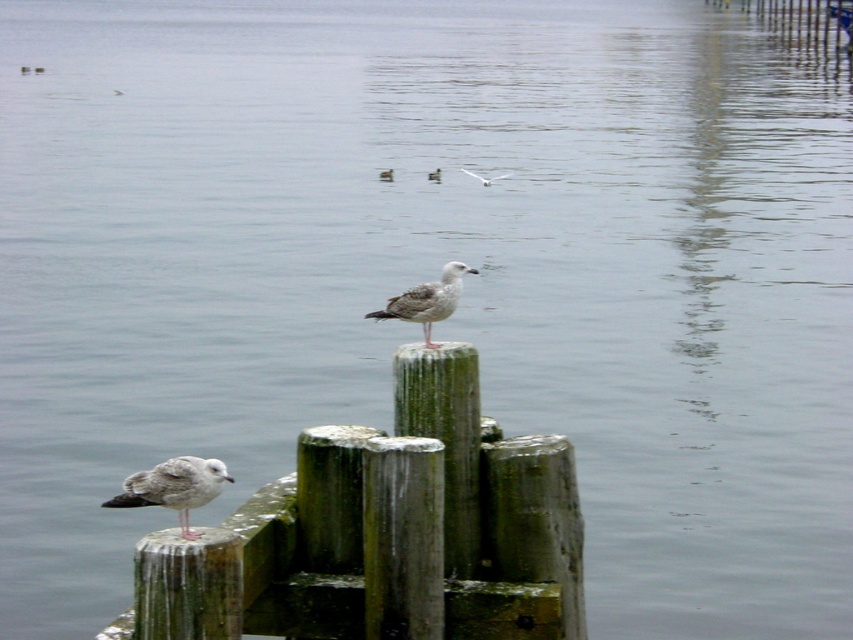
Does green mossy wood post at lower left have a smaller size compared to speckled feathered seagull at lower left?

No, green mossy wood post at lower left is not smaller than speckled feathered seagull at lower left.

Between point (505, 532) and point (209, 493), which one is positioned behind?

Positioned behind is point (505, 532).

This screenshot has height=640, width=853. What are the coordinates of `green mossy wood post at lower left` in the screenshot? It's located at (x=386, y=532).

Between green mossy post at center and gray feathered bird at center, which one appears on the right side from the viewer's perspective?

green mossy post at center

Who is more forward, (x=467, y=432) or (x=390, y=172)?

Positioned in front is point (x=467, y=432).

Between point (474, 444) and point (390, 179), which one is positioned in front?

Point (474, 444) is more forward.

Find the location of a particular element. This screenshot has height=640, width=853. green mossy post at center is located at coordinates (445, 436).

Can you confirm if weathered wood post at center is positioned to the right of white feathered bird at center?

Indeed, weathered wood post at center is positioned on the right side of white feathered bird at center.

Can you confirm if weathered wood post at center is taller than white feathered bird at center?

Yes.

Locate an element on the screen. The width and height of the screenshot is (853, 640). weathered wood post at center is located at coordinates (402, 538).